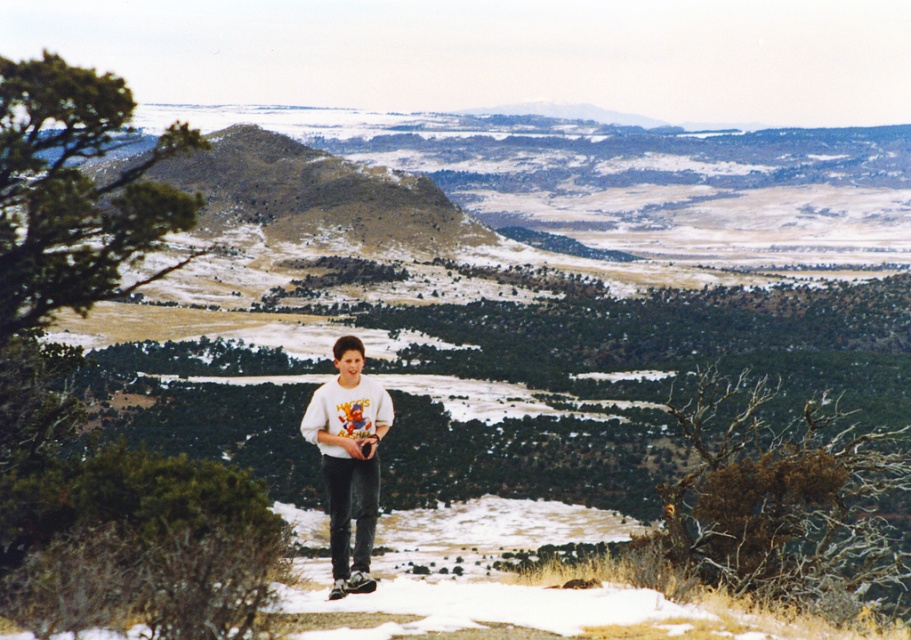
Question: Is white cotton shirt at center to the left of white cotton t-shirt at center from the viewer's perspective?

Choices:
 (A) no
 (B) yes

Answer: (B)

Question: Is white cotton shirt at center positioned before white cotton t-shirt at center?

Choices:
 (A) yes
 (B) no

Answer: (A)

Question: Where is white cotton shirt at center located in relation to white cotton t-shirt at center in the image?

Choices:
 (A) right
 (B) left

Answer: (B)

Question: Which of the following is the closest to the observer?

Choices:
 (A) (326, 419)
 (B) (330, 481)

Answer: (B)

Question: Which object appears closest to the camera in this image?

Choices:
 (A) white cotton t-shirt at center
 (B) white cotton shirt at center

Answer: (B)